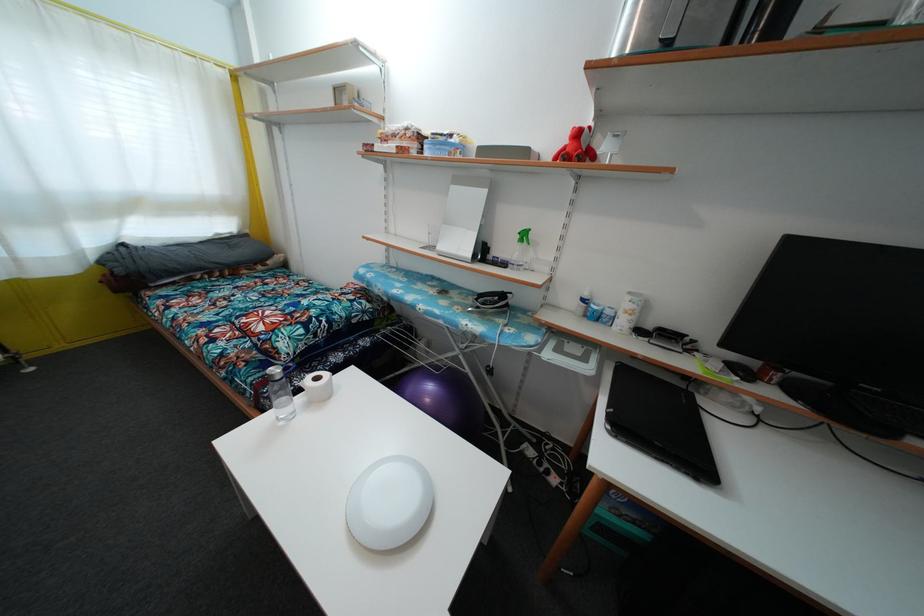
Locate an element on the screen. white toilet paper is located at coordinates (318, 386).